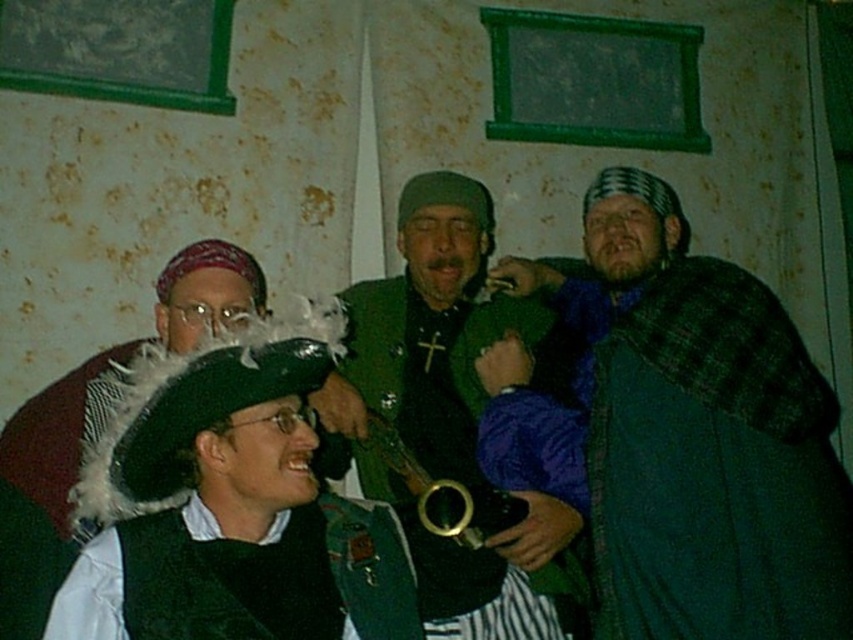
Question: Which object is positioned farthest from the green matte jacket at center?

Choices:
 (A) velvet black hat at center
 (B) velvet green vest at lower left

Answer: (B)

Question: Is green woolen cloak at right bigger than green matte jacket at center?

Choices:
 (A) no
 (B) yes

Answer: (B)

Question: Does velvet green vest at lower left have a smaller size compared to velvet black hat at center?

Choices:
 (A) no
 (B) yes

Answer: (B)

Question: Which object appears closest to the camera in this image?

Choices:
 (A) green woolen cloak at right
 (B) green matte jacket at center
 (C) velvet black hat at center
 (D) velvet green vest at lower left

Answer: (D)

Question: Does velvet green vest at lower left have a larger size compared to velvet black hat at center?

Choices:
 (A) no
 (B) yes

Answer: (A)

Question: Which object appears closest to the camera in this image?

Choices:
 (A) green woolen cloak at right
 (B) green matte jacket at center
 (C) velvet green vest at lower left
 (D) velvet black hat at center

Answer: (C)